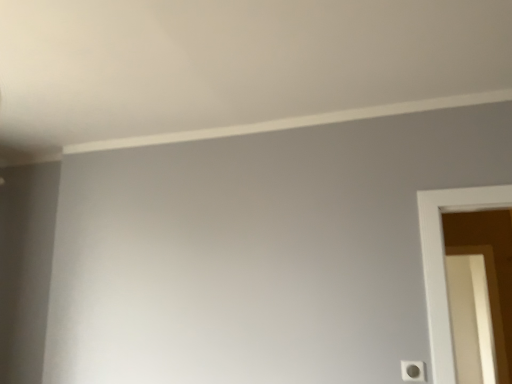
What is the approximate width of white glossy screen door at right?

8.29 inches.

Locate an element on the screen. The height and width of the screenshot is (384, 512). white glossy screen door at right is located at coordinates (475, 315).

In order to face white glossy screen door at right, should I rotate leftwards or rightwards?

Turn right by 26.667 degrees to look at white glossy screen door at right.

The height and width of the screenshot is (384, 512). Describe the element at coordinates (475, 315) in the screenshot. I see `white glossy screen door at right` at that location.

Image resolution: width=512 pixels, height=384 pixels. What do you see at coordinates (413, 371) in the screenshot?
I see `white plastic light switch at lower right` at bounding box center [413, 371].

Identify the location of white plastic light switch at lower right. (413, 371).

Locate an element on the screen. white glossy screen door at right is located at coordinates (475, 315).

Which object is positioned more to the right, white plastic light switch at lower right or white glossy screen door at right?

white glossy screen door at right.

Relative to white glossy screen door at right, is white plastic light switch at lower right in front or behind?

white plastic light switch at lower right is positioned closer to the viewer than white glossy screen door at right.

Is point (409, 376) less distant than point (470, 269)?

Yes, point (409, 376) is in front of point (470, 269).

Based on the photo, from the image's perspective, is white plastic light switch at lower right below white glossy screen door at right?

Incorrect, from the image's perspective, white plastic light switch at lower right is higher than white glossy screen door at right.

From a real-world perspective, between white plastic light switch at lower right and white glossy screen door at right, who is vertically lower?

white plastic light switch at lower right is physically lower.

Is white plastic light switch at lower right wider or thinner than white glossy screen door at right?

white plastic light switch at lower right is thinner than white glossy screen door at right.

Does white plastic light switch at lower right have a greater height compared to white glossy screen door at right?

No, white plastic light switch at lower right is not taller than white glossy screen door at right.

Can you confirm if white plastic light switch at lower right is bigger than white glossy screen door at right?

Actually, white plastic light switch at lower right might be smaller than white glossy screen door at right.

Can white glossy screen door at right be found inside white plastic light switch at lower right?

No, white glossy screen door at right is not a part of white plastic light switch at lower right.

Is white plastic light switch at lower right positioned far away from white glossy screen door at right?

white plastic light switch at lower right is positioned a significant distance from white glossy screen door at right.

Is white plastic light switch at lower right looking in the opposite direction of white glossy screen door at right?

Absolutely, white plastic light switch at lower right is directed away from white glossy screen door at right.

Measure the distance between white plastic light switch at lower right and white glossy screen door at right.

white plastic light switch at lower right and white glossy screen door at right are 2.41 meters apart.

The image size is (512, 384). I want to click on light switch beneath the white glossy screen door at right (from a real-world perspective), so click(413, 371).

Between white glossy screen door at right and white plastic light switch at lower right, which one appears on the right side from the viewer's perspective?

From the viewer's perspective, white glossy screen door at right appears more on the right side.

Which is in front, white glossy screen door at right or white plastic light switch at lower right?

white plastic light switch at lower right.

Considering the positions of point (452, 311) and point (401, 363), is point (452, 311) closer or farther from the camera than point (401, 363)?

Clearly, point (452, 311) is more distant from the camera than point (401, 363).

From the image's perspective, is white glossy screen door at right above or below white plastic light switch at lower right?

white glossy screen door at right is situated lower than white plastic light switch at lower right in the image.

From a real-world perspective, which is physically above, white glossy screen door at right or white plastic light switch at lower right?

white glossy screen door at right.

Which of these two, white glossy screen door at right or white plastic light switch at lower right, is wider?

white glossy screen door at right.

Who is taller, white glossy screen door at right or white plastic light switch at lower right?

white glossy screen door at right.

Considering the relative sizes of white glossy screen door at right and white plastic light switch at lower right in the image provided, is white glossy screen door at right smaller than white plastic light switch at lower right?

No, white glossy screen door at right is not smaller than white plastic light switch at lower right.

Based on the photo, could white plastic light switch at lower right be considered to be inside white glossy screen door at right?

No.

Is white glossy screen door at right next to white plastic light switch at lower right and touching it?

No, white glossy screen door at right is not making contact with white plastic light switch at lower right.

Is white plastic light switch at lower right at the back of white glossy screen door at right?

That's not correct — white glossy screen door at right is not looking away from white plastic light switch at lower right.

How different are the orientations of white glossy screen door at right and white plastic light switch at lower right in degrees?

They differ by 0.53 degrees in their facing directions.

How distant is white glossy screen door at right from white plastic light switch at lower right?

white glossy screen door at right and white plastic light switch at lower right are 2.41 meters apart from each other.

Image resolution: width=512 pixels, height=384 pixels. What are the coordinates of `light switch below the white glossy screen door at right (from a real-world perspective)` in the screenshot? It's located at (413, 371).

Find the location of a particular element. This screenshot has height=384, width=512. screen door on the right of white plastic light switch at lower right is located at coordinates (475, 315).

The height and width of the screenshot is (384, 512). I want to click on screen door behind the white plastic light switch at lower right, so click(475, 315).